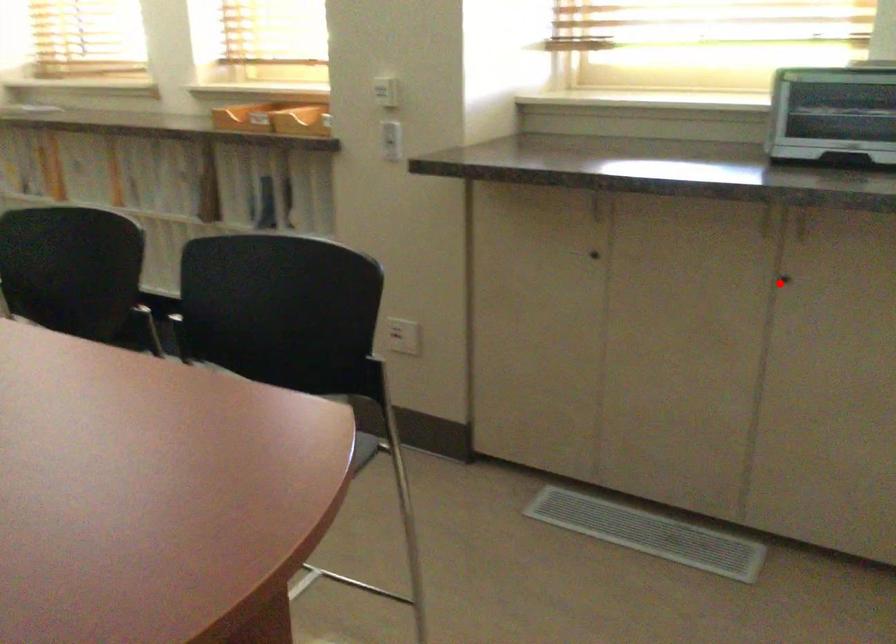
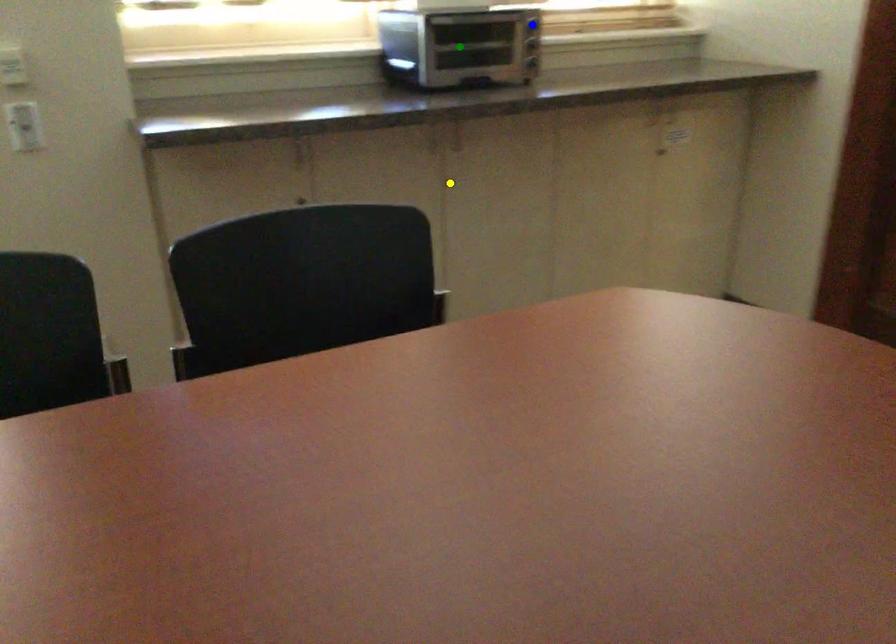
Question: I am providing you with two images of the same scene from different viewpoints. A red point is marked on the first image. You are given multiple points on the second image. Can you choose the point in image 2 that corresponds to the point in image 1?

Choices:
 (A) yellow point
 (B) green point
 (C) blue point

Answer: (A)